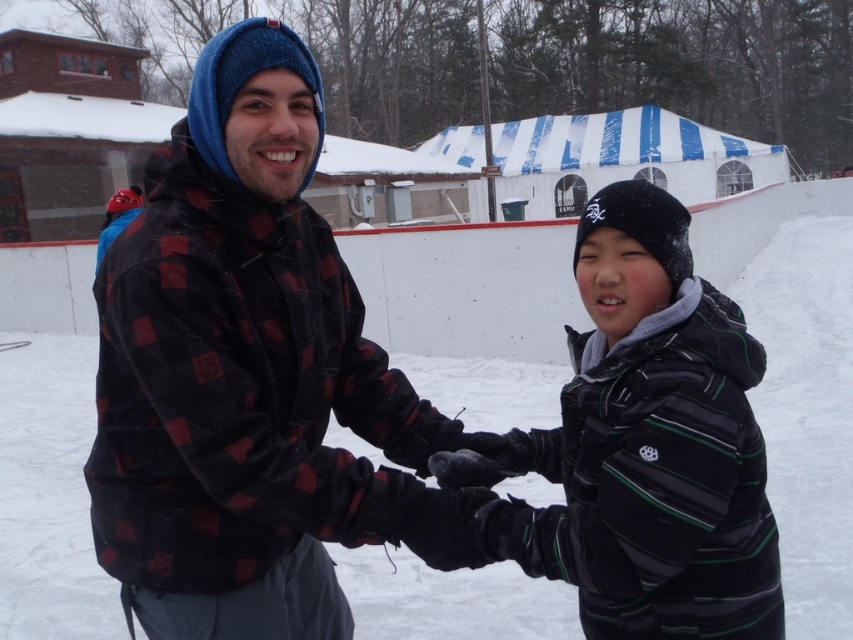
Is white fluffy snow at center thinner than striped fleece jacket at center?

In fact, white fluffy snow at center might be wider than striped fleece jacket at center.

The width and height of the screenshot is (853, 640). Find the location of `white fluffy snow at center`. white fluffy snow at center is located at coordinates (807, 412).

The height and width of the screenshot is (640, 853). In order to click on white fluffy snow at center in this screenshot , I will do `click(807, 412)`.

Identify the location of plaid fabric jacket at center. The width and height of the screenshot is (853, 640). (250, 378).

Is point (125, 404) farther from viewer compared to point (24, 449)?

No, it is not.

Identify the location of plaid fabric jacket at center. (250, 378).

Is plaid fabric jacket at center closer to the viewer compared to striped fleece jacket at center?

No, plaid fabric jacket at center is further to the viewer.

Measure the distance between plaid fabric jacket at center and striped fleece jacket at center.

plaid fabric jacket at center is 21.06 inches away from striped fleece jacket at center.

Is point (212, 129) less distant than point (581, 513)?

That is False.

This screenshot has height=640, width=853. Identify the location of plaid fabric jacket at center. (250, 378).